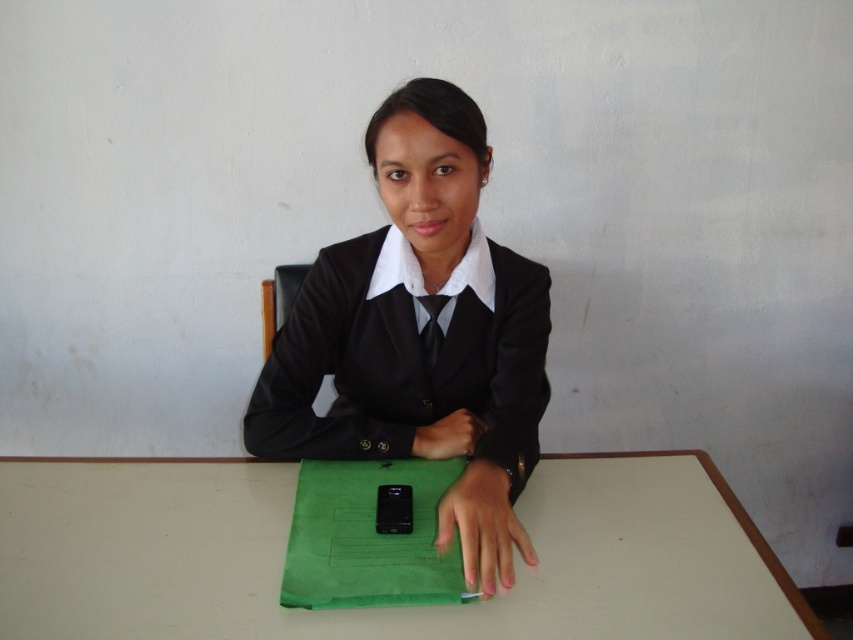
Question: Which point is closer to the camera?

Choices:
 (A) (503, 544)
 (B) (431, 198)
 (C) (672, 637)
 (D) (476, 438)

Answer: (C)

Question: Is white matte table at center in front of smooth skin hand at center?

Choices:
 (A) yes
 (B) no

Answer: (A)

Question: Considering the relative positions of white matte table at center and matte black hand at center in the image provided, where is white matte table at center located with respect to matte black hand at center?

Choices:
 (A) right
 (B) left

Answer: (B)

Question: Which point is farther to the camera?

Choices:
 (A) white matte table at center
 (B) matte black hand at center
 (C) black matte uniform at center

Answer: (B)

Question: Is the position of white matte table at center more distant than that of black matte uniform at center?

Choices:
 (A) yes
 (B) no

Answer: (B)

Question: Among these objects, which one is farthest from the camera?

Choices:
 (A) smooth skin hand at center
 (B) matte black hand at center
 (C) black matte uniform at center
 (D) white matte table at center

Answer: (B)